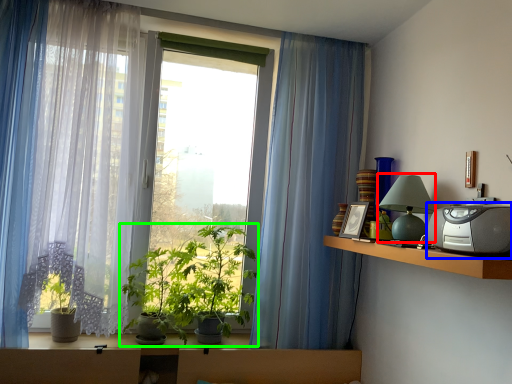
Question: Which object is positioned farthest from table lamp (highlighted by a red box)? Select from appliance (highlighted by a blue box) and houseplant (highlighted by a green box).

Choices:
 (A) appliance
 (B) houseplant

Answer: (B)